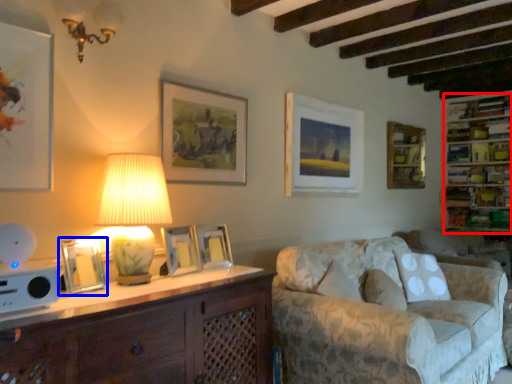
Question: Which point is closer to the camera, shelf (highlighted by a red box) or picture frame (highlighted by a blue box)?

Choices:
 (A) shelf
 (B) picture frame

Answer: (B)